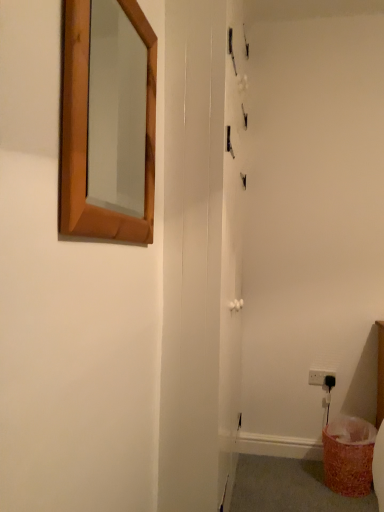
Question: From a real-world perspective, is orange textured laundry basket at lower right on white glossy screen door at center?

Choices:
 (A) yes
 (B) no

Answer: (B)

Question: Can you confirm if orange textured laundry basket at lower right is shorter than white glossy screen door at center?

Choices:
 (A) no
 (B) yes

Answer: (B)

Question: Is the depth of orange textured laundry basket at lower right greater than that of white glossy screen door at center?

Choices:
 (A) no
 (B) yes

Answer: (B)

Question: Considering the relative sizes of orange textured laundry basket at lower right and white glossy screen door at center in the image provided, is orange textured laundry basket at lower right thinner than white glossy screen door at center?

Choices:
 (A) yes
 (B) no

Answer: (B)

Question: Can you confirm if orange textured laundry basket at lower right is bigger than white glossy screen door at center?

Choices:
 (A) yes
 (B) no

Answer: (B)

Question: Does orange textured laundry basket at lower right have a greater height compared to white glossy screen door at center?

Choices:
 (A) yes
 (B) no

Answer: (B)

Question: From the image's perspective, is white glossy screen door at center under white plastic electric outlet at lower right?

Choices:
 (A) yes
 (B) no

Answer: (B)

Question: Is white glossy screen door at center oriented towards white plastic electric outlet at lower right?

Choices:
 (A) yes
 (B) no

Answer: (A)

Question: Considering the relative sizes of white glossy screen door at center and white plastic electric outlet at lower right in the image provided, is white glossy screen door at center shorter than white plastic electric outlet at lower right?

Choices:
 (A) yes
 (B) no

Answer: (B)

Question: Is white glossy screen door at center bigger than white plastic electric outlet at lower right?

Choices:
 (A) no
 (B) yes

Answer: (B)

Question: Is white glossy screen door at center surrounding white plastic electric outlet at lower right?

Choices:
 (A) no
 (B) yes

Answer: (A)

Question: Is white glossy screen door at center thinner than white plastic electric outlet at lower right?

Choices:
 (A) no
 (B) yes

Answer: (A)

Question: From the image's perspective, is orange textured laundry basket at lower right on top of wooden-framed mirror at upper left?

Choices:
 (A) no
 (B) yes

Answer: (A)